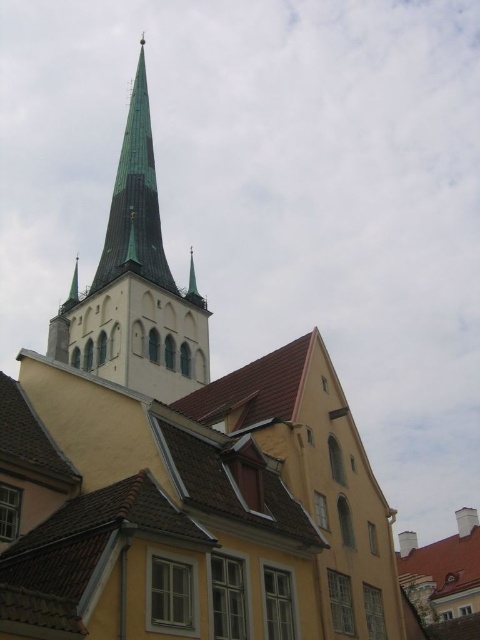
Question: Does green glass spire at upper center come behind green copper spire at upper center?

Choices:
 (A) yes
 (B) no

Answer: (B)

Question: Is green glass spire at upper center bigger than green copper spire at upper center?

Choices:
 (A) no
 (B) yes

Answer: (B)

Question: Which point appears farthest from the camera in this image?

Choices:
 (A) (154, 282)
 (B) (134, 92)

Answer: (B)

Question: Can you confirm if green glass spire at upper center is smaller than green copper spire at upper center?

Choices:
 (A) yes
 (B) no

Answer: (B)

Question: Which point appears farthest from the camera in this image?

Choices:
 (A) (146, 371)
 (B) (148, 131)

Answer: (B)